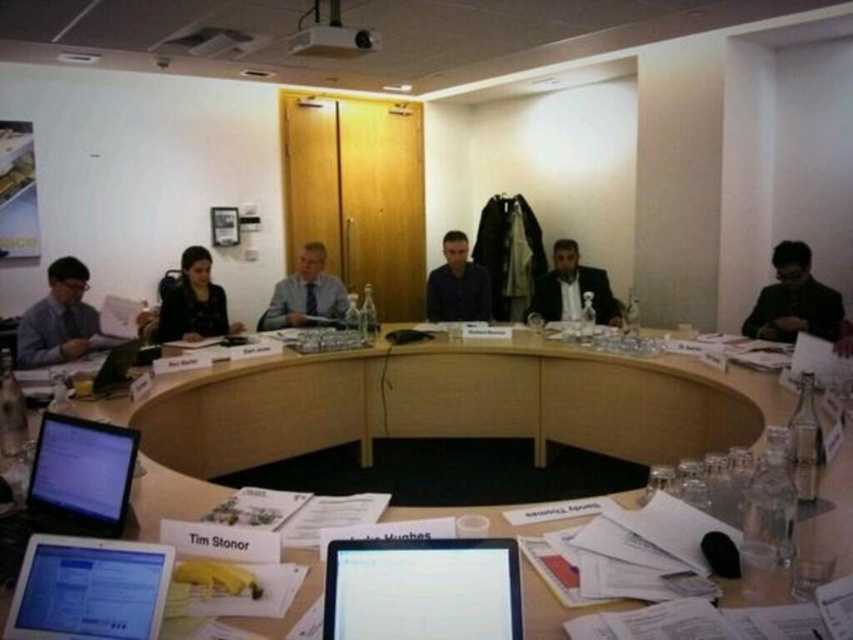
Question: Which of the following is the farthest from the observer?

Choices:
 (A) wooden table at center
 (B) matte blue shirt at center

Answer: (B)

Question: Which of the following is the farthest from the observer?

Choices:
 (A) (175, 324)
 (B) (444, 301)

Answer: (B)

Question: From the image, what is the correct spatial relationship of black suit at right in relation to light gray shirt at center?

Choices:
 (A) right
 (B) left

Answer: (A)

Question: Can you confirm if matte black dress at center is positioned above light gray shirt at center?

Choices:
 (A) yes
 (B) no

Answer: (A)

Question: Which point appears closest to the camera in this image?

Choices:
 (A) (788, 253)
 (B) (27, 324)

Answer: (B)

Question: Is silver metallic tablet at lower left smaller than dark gray suit at center?

Choices:
 (A) yes
 (B) no

Answer: (A)